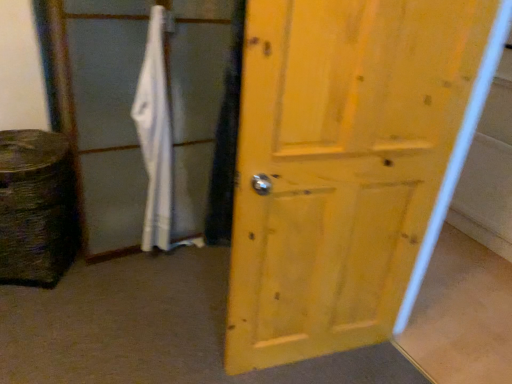
Locate an element on the screen. The height and width of the screenshot is (384, 512). free space in front of white fabric bath towel at center-left is located at coordinates (150, 279).